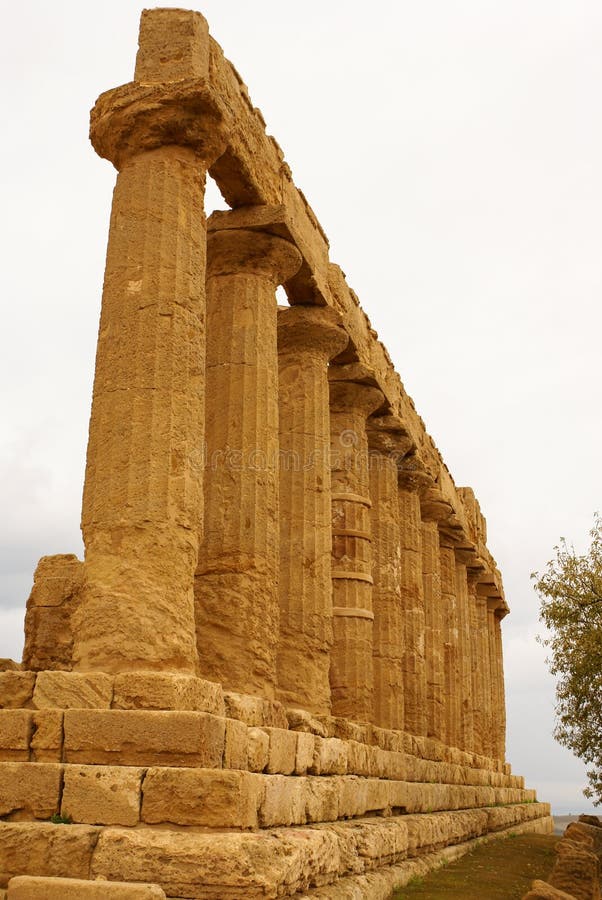
Where is `brown top molding`? brown top molding is located at coordinates (318, 280).